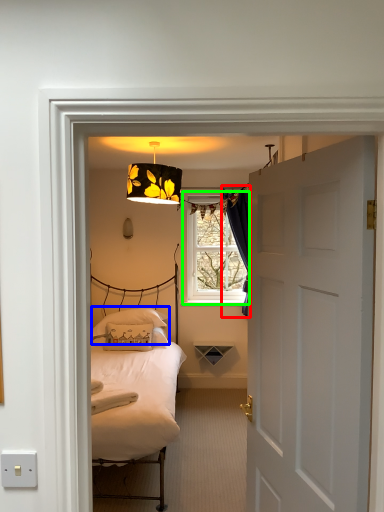
Question: Considering the real-world distances, which object is closest to curtain (highlighted by a red box)? pillow (highlighted by a blue box) or window (highlighted by a green box).

Choices:
 (A) pillow
 (B) window

Answer: (B)